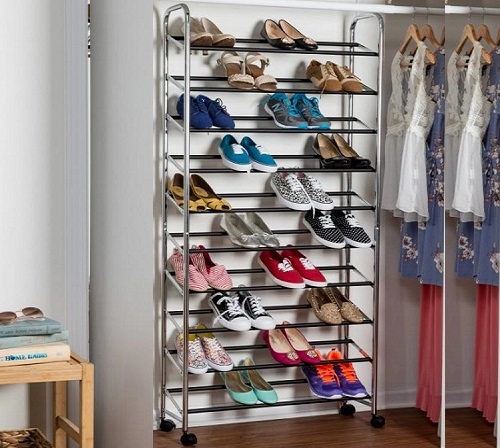
The width and height of the screenshot is (500, 448). I want to click on clothes hangers, so click(411, 34), click(427, 32), click(470, 31), click(484, 30).